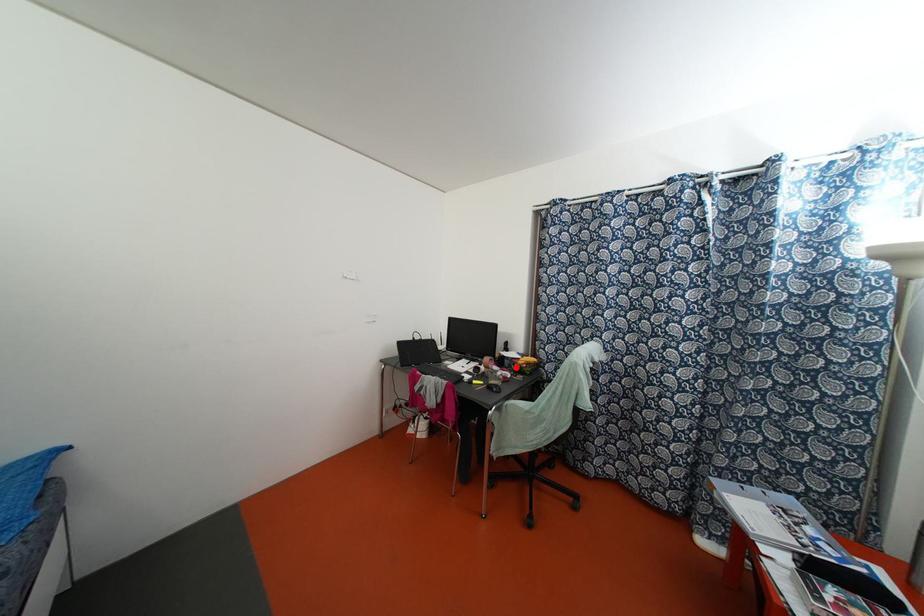
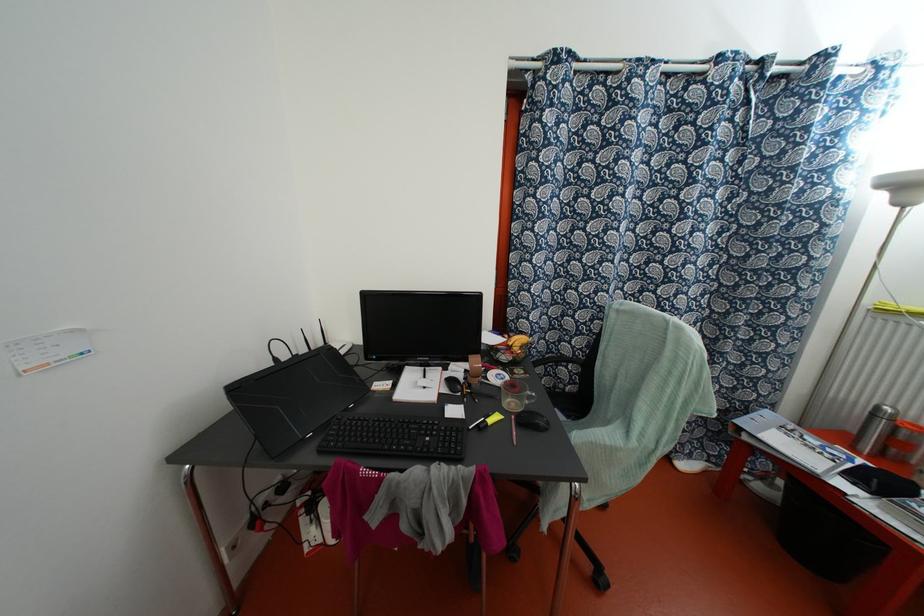
Where in the second image is the point corresponding to the highlighted location from the first image?

(504, 357)